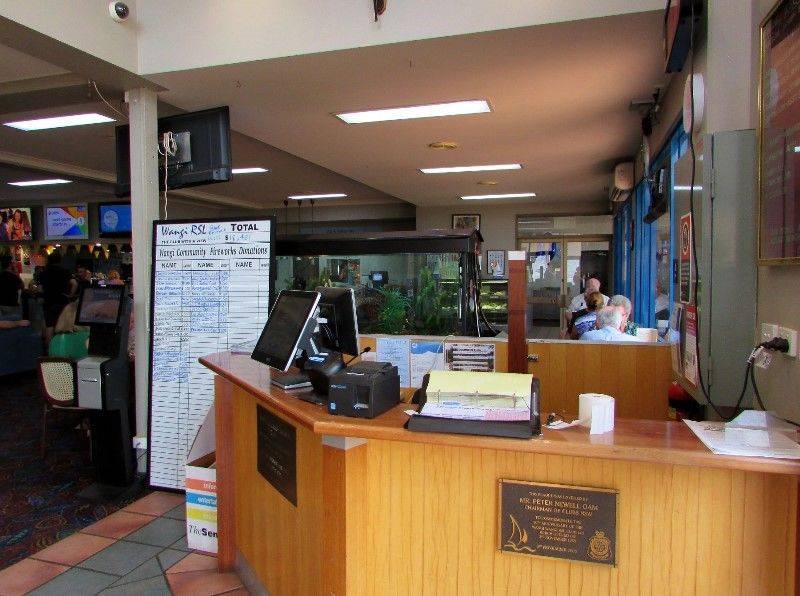
Image resolution: width=800 pixels, height=596 pixels. I want to click on tile flooring, so click(x=136, y=554).